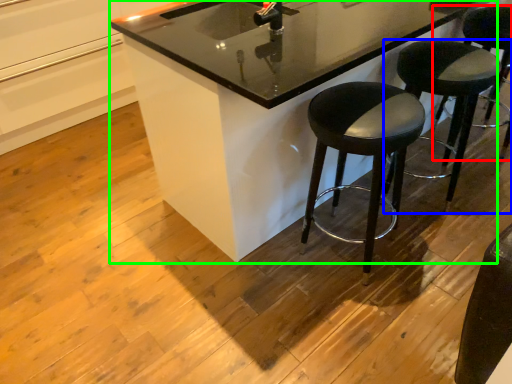
Question: Based on their relative distances, which object is farther from stool (highlighted by a red box)? Choose from stool (highlighted by a blue box) and counter (highlighted by a green box).

Choices:
 (A) stool
 (B) counter

Answer: (B)